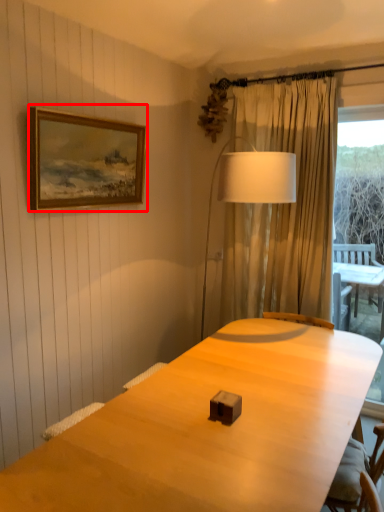
Question: From the image's perspective, considering the relative positions of picture frame (annotated by the red box) and table lamp in the image provided, where is picture frame (annotated by the red box) located with respect to the staircase?

Choices:
 (A) below
 (B) above

Answer: (B)